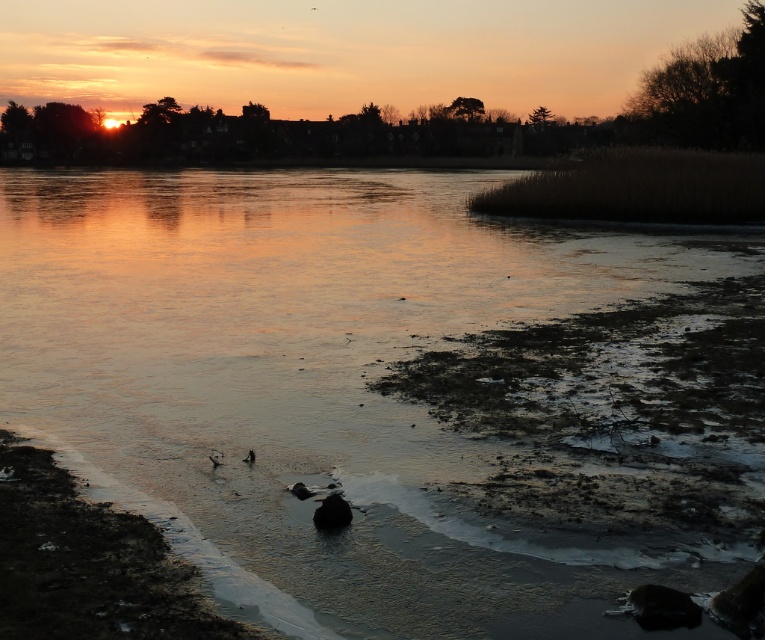
You are an artist planning to paint the sunset scene. You want to ensure the shiny black rock at center and the brown fuzzy duck at lower center are accurately sized. Which object should you make larger in your painting?

The shiny black rock at center should be made larger than the brown fuzzy duck at lower center because it is described as larger in size.

You are standing at the point labeled as point (249, 456) in the image. What object are you observing from this location?

You are observing the brown fuzzy bird at lower center from the point labeled as point (249, 456).

You are an ornithologist observing the brown fuzzy bird at lower center and the shiny black rock at center. Which object takes up more space in the image?

The shiny black rock at center is larger in size than the brown fuzzy bird at lower center, so it takes up more space in the image.